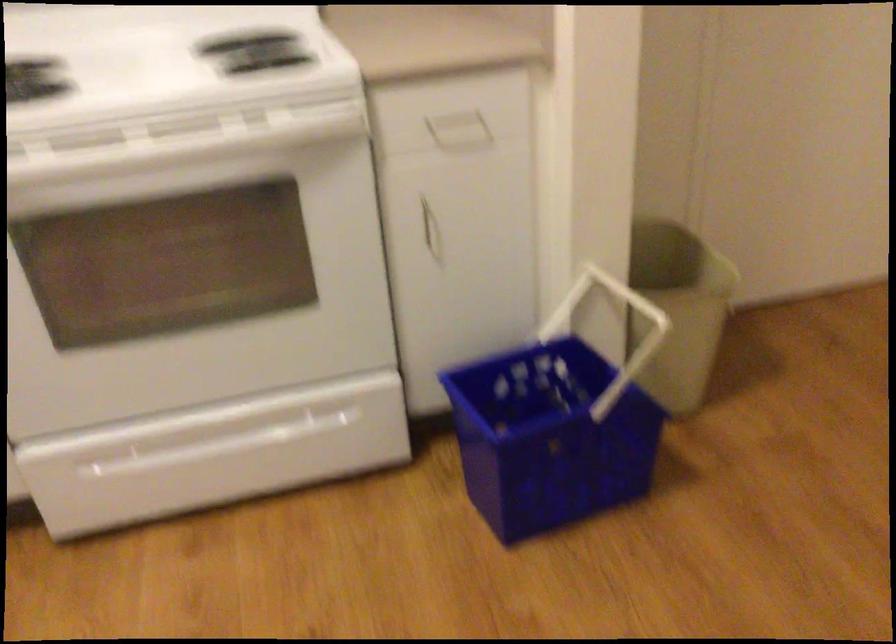
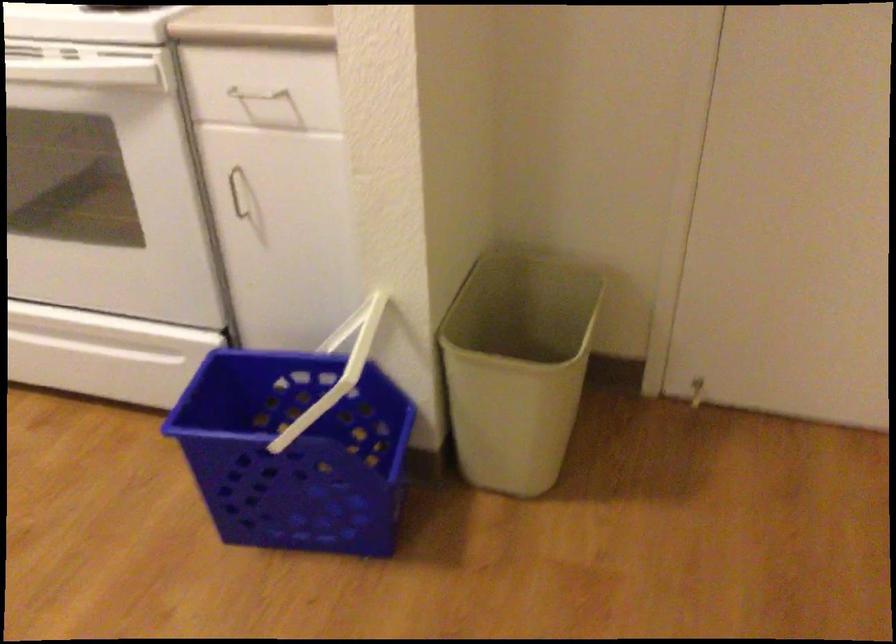
In the second image, find the point that corresponds to (x=418, y=214) in the first image.

(237, 192)